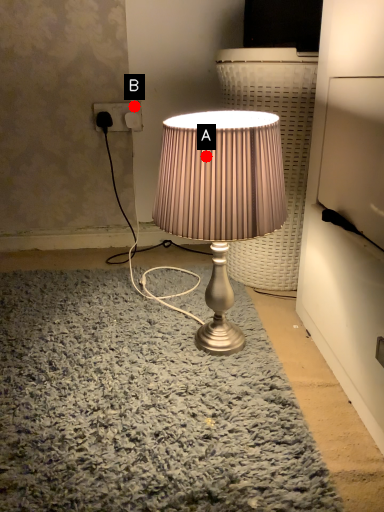
Question: Two points are circled on the image, labeled by A and B beside each circle. Which point is closer to the camera?

Choices:
 (A) A is closer
 (B) B is closer

Answer: (A)